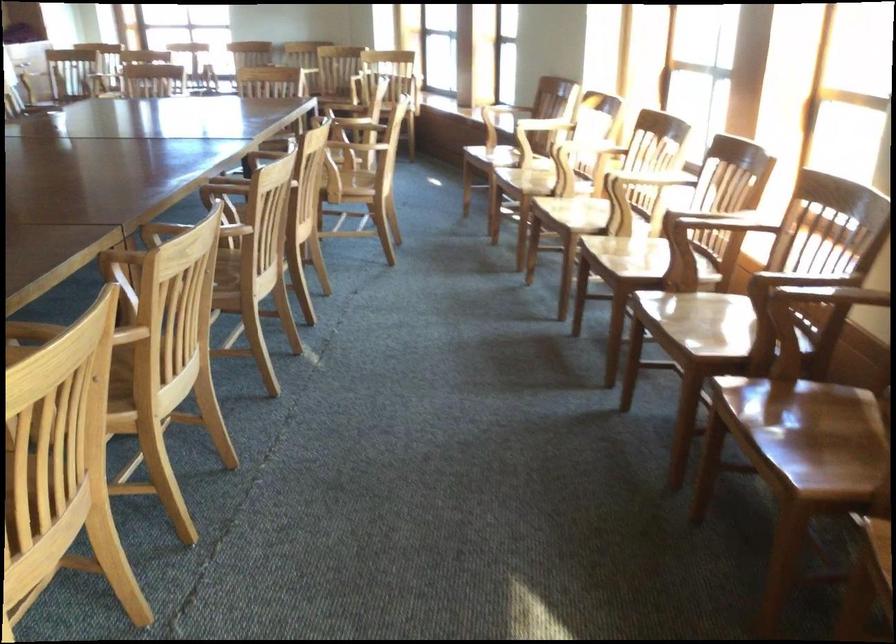
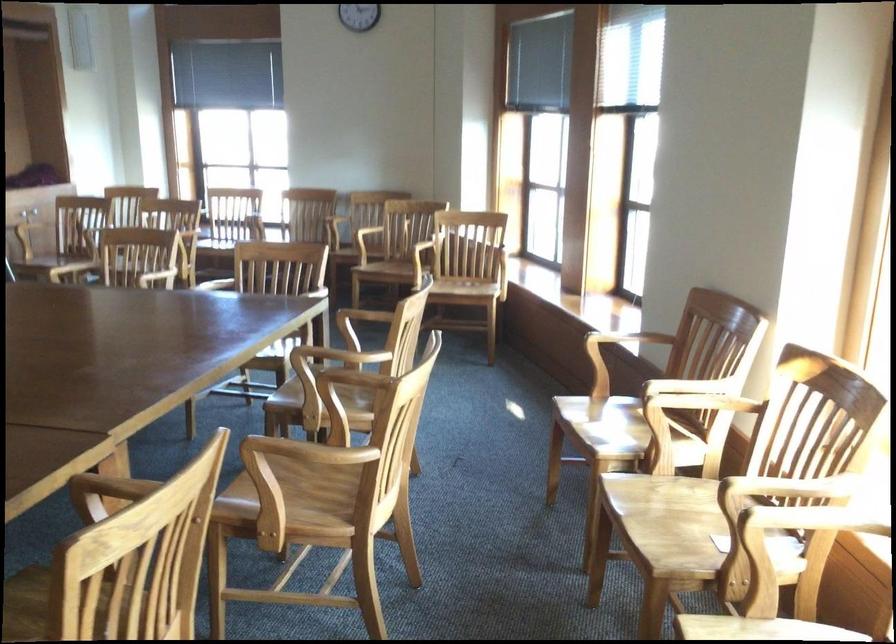
The point at (332, 180) is marked in the first image. Where is the corresponding point in the second image?

(294, 489)